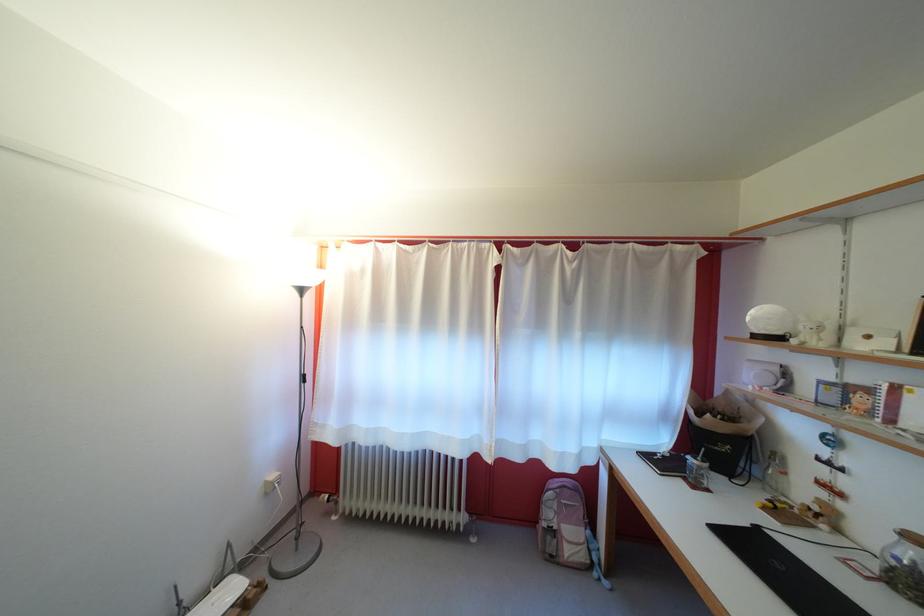
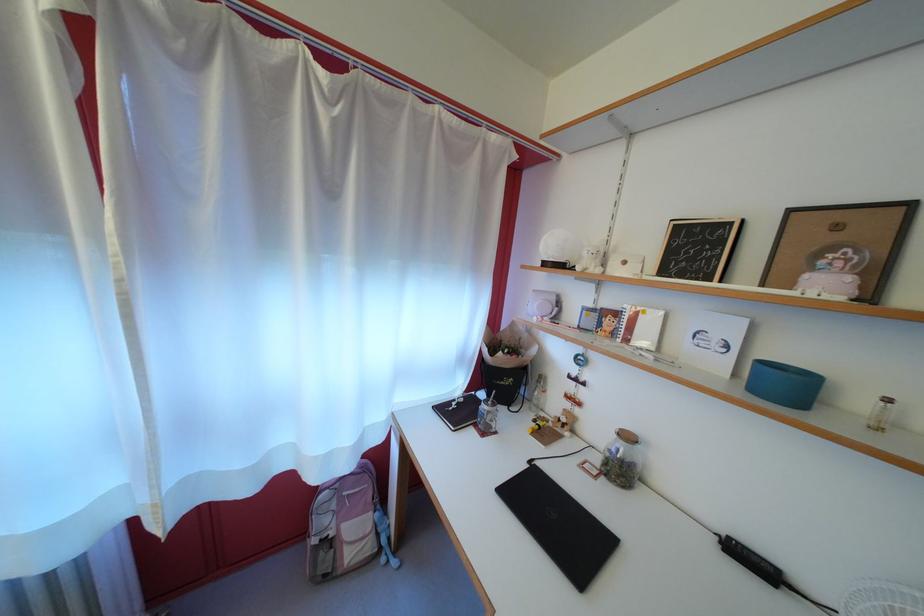
Find the pixel in the second image that matches (x=603, y=581) in the first image.

(392, 565)